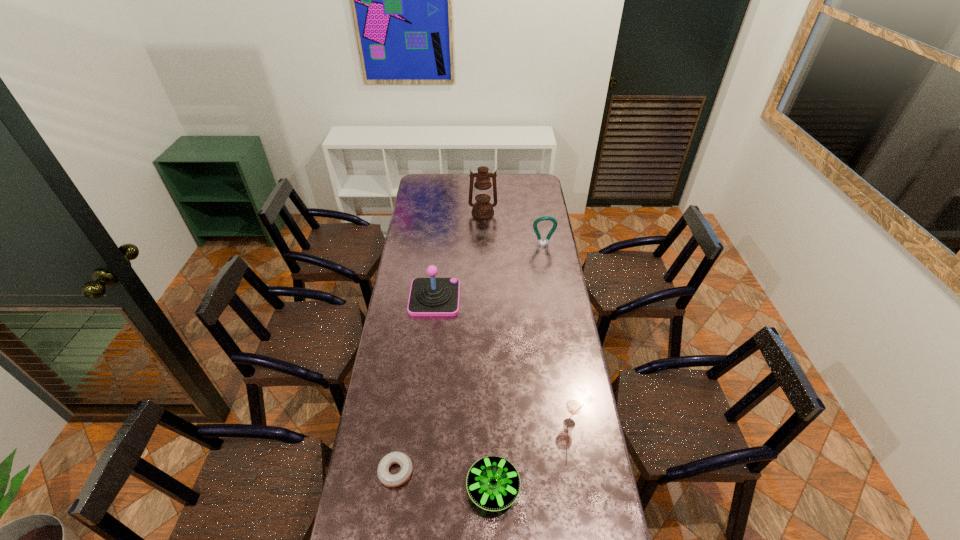
Identify the location of object that is the fifth closest one to the bottle opener. This screenshot has width=960, height=540. (391, 480).

Identify which object is the closest to the tallest object. Please provide its 2D coordinates. Your answer should be formatted as a tuple, i.e. [(x, y)], where the tuple contains the x and y coordinates of a point satisfying the conditions above.

[(546, 242)]

I want to click on vacant space that satisfies the following two spatial constraints: 1. forward from the base of the third farthest object; 2. on the right side of the fifth tallest object, so click(x=415, y=488).

Locate an element on the screen. free location that satisfies the following two spatial constraints: 1. forward from the base of the second shortest object; 2. on the right side of the third farthest object is located at coordinates (415, 488).

Identify the location of free space in the image that satisfies the following two spatial constraints: 1. on the back side of the straw; 2. forward from the base of the third farthest object. Image resolution: width=960 pixels, height=540 pixels. (550, 298).